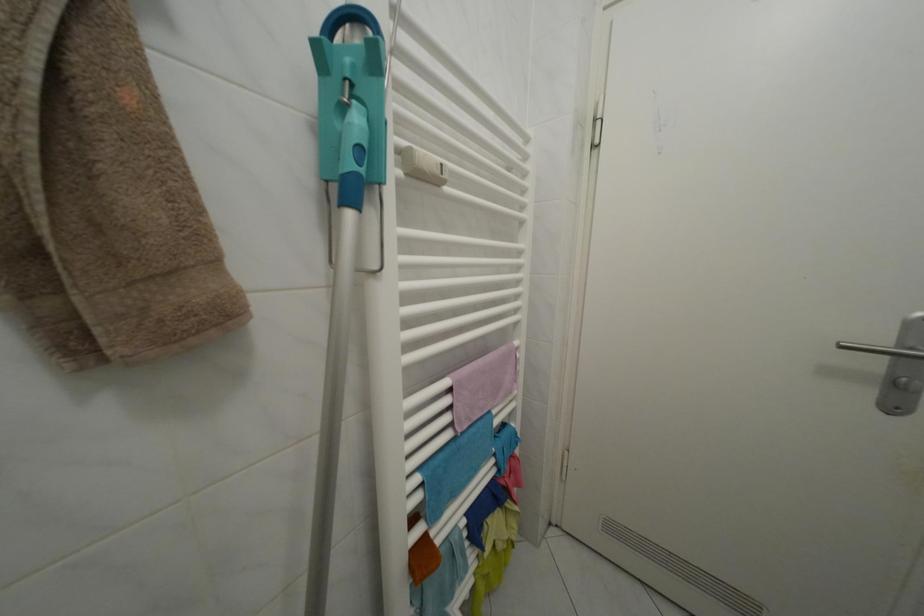
At what (x,y) coordinates should I click in order to perform the action: click on mop head button. Please return your answer as a coordinate pair (x, y). This screenshot has width=924, height=616. Looking at the image, I should click on (359, 156).